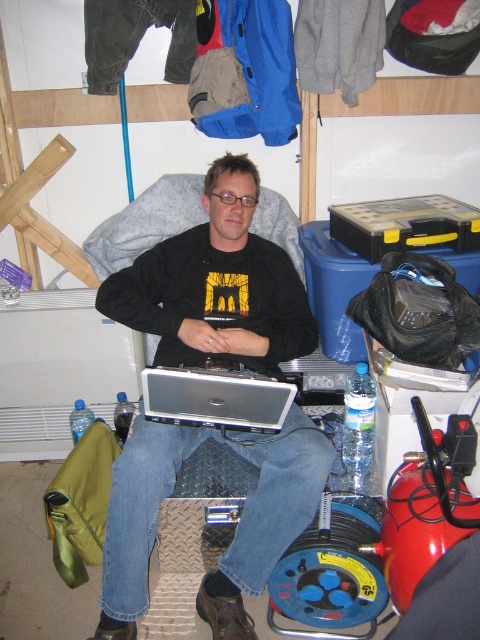
Question: Is black matte laptop at center below silver metallic laptop at center?

Choices:
 (A) no
 (B) yes

Answer: (A)

Question: Is black matte laptop at center smaller than silver metallic laptop at center?

Choices:
 (A) yes
 (B) no

Answer: (B)

Question: Which point is farther from the camera taking this photo?

Choices:
 (A) (189, 408)
 (B) (240, 275)

Answer: (B)

Question: Can you confirm if black matte laptop at center is positioned to the right of silver metallic laptop at center?

Choices:
 (A) no
 (B) yes

Answer: (A)

Question: Which point appears closest to the camera in this image?

Choices:
 (A) (310, 456)
 (B) (214, 376)

Answer: (B)

Question: Which object appears farthest from the camera in this image?

Choices:
 (A) silver metallic laptop at center
 (B) black matte laptop at center

Answer: (B)